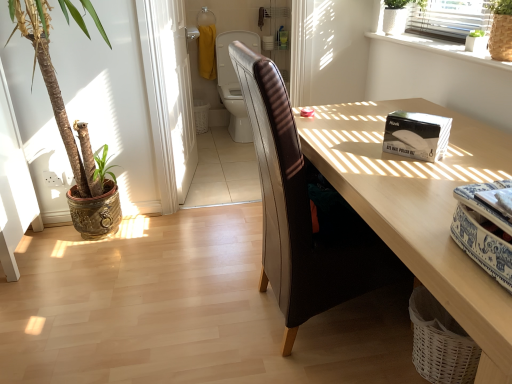
Where is `green leafy plant at upper right, which is counted as the third houseplant, starting from the left`? This screenshot has height=384, width=512. green leafy plant at upper right, which is counted as the third houseplant, starting from the left is located at coordinates (476, 41).

What do you see at coordinates (476, 41) in the screenshot? I see `green leafy plant at upper right, positioned as the second houseplant in right-to-left order` at bounding box center [476, 41].

Find the location of a particular element. This screenshot has height=384, width=512. woven beige basket at center is located at coordinates tap(201, 115).

Image resolution: width=512 pixels, height=384 pixels. I want to click on white textured plant at upper right, placed as the 3th houseplant when sorted from right to left, so click(398, 15).

What do you see at coordinates (421, 208) in the screenshot?
I see `light wood desk at center` at bounding box center [421, 208].

You are a GUI agent. You are given a task and a screenshot of the screen. Output one action in this format:
    pyautogui.click(x=<x>, y=<y>)
    Task: Click on the green woven basket at upper right, the first houseplant from the right
    This screenshot has height=384, width=512.
    Given the screenshot: What is the action you would take?
    pyautogui.click(x=501, y=30)

Find the location of a particular element. Image resolution: width=512 pixels, height=384 pixels. green leafy plant at upper right, which is counted as the third houseplant, starting from the left is located at coordinates (476, 41).

Which object is thinner, white glossy nail polish kit at upper right or woven beige basket at center?

white glossy nail polish kit at upper right is thinner.

Does white glossy nail polish kit at upper right have a smaller size compared to woven beige basket at center?

Indeed, white glossy nail polish kit at upper right has a smaller size compared to woven beige basket at center.

From a real-world perspective, is white glossy nail polish kit at upper right physically located above or below woven beige basket at center?

In terms of real-world spatial position, white glossy nail polish kit at upper right is above woven beige basket at center.

How many degrees apart are the facing directions of white glossy nail polish kit at upper right and woven beige basket at center?

56.8 degrees.

Find the location of a particular element. screen door above the leather at center (from a real-world perspective) is located at coordinates (169, 97).

From the image's perspective, is leather at center above or below white glossy screen door at upper center?

Clearly, from the image's perspective, leather at center is below white glossy screen door at upper center.

Is leather at center touching white glossy screen door at upper center?

leather at center is not next to white glossy screen door at upper center, and they're not touching.

Can you tell me how much leather at center and white glossy screen door at upper center differ in facing direction?

The angular difference between leather at center and white glossy screen door at upper center is 11 degrees.

Is green leafy plant at upper right, which is counted as the third houseplant, starting from the left, directly adjacent to white wicker laundry basket at lower right?

No, green leafy plant at upper right, which is counted as the third houseplant, starting from the left, is not next to white wicker laundry basket at lower right.

Is green leafy plant at upper right, positioned as the second houseplant in right-to-left order, facing towards white wicker laundry basket at lower right?

No, green leafy plant at upper right, positioned as the second houseplant in right-to-left order, is not aimed at white wicker laundry basket at lower right.

From the picture: Do you think green leafy plant at upper right, positioned as the second houseplant in right-to-left order, is within white wicker laundry basket at lower right, or outside of it?

green leafy plant at upper right, positioned as the second houseplant in right-to-left order, lies outside white wicker laundry basket at lower right.

Can you tell me how much green leafy plant at upper right, positioned as the second houseplant in right-to-left order, and white wicker laundry basket at lower right differ in facing direction?

They differ by 1.54 degrees in their facing directions.

From a real-world perspective, is leather-like brown swivel chair at center under white glossy nail polish kit at upper right?

Correct, in the physical world, leather-like brown swivel chair at center is lower than white glossy nail polish kit at upper right.

Is leather-like brown swivel chair at center in contact with white glossy nail polish kit at upper right?

leather-like brown swivel chair at center and white glossy nail polish kit at upper right are not in contact.

Between leather-like brown swivel chair at center and white glossy nail polish kit at upper right, which one appears on the right side from the viewer's perspective?

Positioned to the right is white glossy nail polish kit at upper right.

From their relative heights in the image, would you say leather-like brown swivel chair at center is taller or shorter than white glossy nail polish kit at upper right?

In the image, leather-like brown swivel chair at center appears to be taller than white glossy nail polish kit at upper right.

Which is more to the right, green leafy plant in textured pot at left, the first houseplant from the left, or leather-like brown swivel chair at center?

From the viewer's perspective, leather-like brown swivel chair at center appears more on the right side.

Considering the relative sizes of green leafy plant in textured pot at left, the first houseplant from the left, and leather-like brown swivel chair at center in the image provided, is green leafy plant in textured pot at left, the first houseplant from the left, bigger than leather-like brown swivel chair at center?

Yes.

From the image's perspective, which object appears higher, green leafy plant in textured pot at left, the first houseplant from the left, or leather-like brown swivel chair at center?

leather-like brown swivel chair at center is shown above in the image.

Is green leafy plant in textured pot at left, which is the 4th houseplant in right-to-left order, shorter than leather-like brown swivel chair at center?

In fact, green leafy plant in textured pot at left, which is the 4th houseplant in right-to-left order, may be taller than leather-like brown swivel chair at center.

How different are the orientations of white textured plant at upper right, marked as the 2th houseplant in a left-to-right arrangement, and white glossy window sill at upper right in degrees?

The angle between the facing direction of white textured plant at upper right, marked as the 2th houseplant in a left-to-right arrangement, and the facing direction of white glossy window sill at upper right is 0.488 degrees.

Which object is wider, white textured plant at upper right, placed as the 3th houseplant when sorted from right to left, or white glossy window sill at upper right?

white textured plant at upper right, placed as the 3th houseplant when sorted from right to left, is wider.

Would you say white textured plant at upper right, placed as the 3th houseplant when sorted from right to left, is outside white glossy window sill at upper right?

white textured plant at upper right, placed as the 3th houseplant when sorted from right to left, lies outside white glossy window sill at upper right's area.

Between woven beige basket at center and leather at center, which one has larger size?

leather at center.

Which object is thinner, woven beige basket at center or leather at center?

With smaller width is woven beige basket at center.

The height and width of the screenshot is (384, 512). In order to click on chair above the woven beige basket at center (from a real-world perspective) in this screenshot , I will do `click(301, 213)`.

Looking at this image, is woven beige basket at center surrounding leather at center?

No, leather at center is not inside woven beige basket at center.

The image size is (512, 384). Identify the location of basket directly beneath the white glossy nail polish kit at upper right (from a real-world perspective). (201, 115).

Identify the location of chair that is in front of the white glossy screen door at upper center. (301, 213).

When comparing their distances from light wood desk at center, does white glossy window sill at upper right or green leafy plant at upper right, positioned as the second houseplant in right-to-left order, seem further?

green leafy plant at upper right, positioned as the second houseplant in right-to-left order.

Estimate the real-world distances between objects in this image. Which object is further from white glossy nail polish kit at upper right, leather-like brown swivel chair at center or light wood desk at center?

Among the two, leather-like brown swivel chair at center is located further to white glossy nail polish kit at upper right.

From the picture: When comparing their distances from green leafy plant in textured pot at left, the first houseplant from the left, does white glossy nail polish kit at upper right or leather-like brown swivel chair at center seem closer?

The object closer to green leafy plant in textured pot at left, the first houseplant from the left, is white glossy nail polish kit at upper right.

From the picture: Estimate the real-world distances between objects in this image. Which object is further from woven beige basket at center, white glossy window sill at upper right or white glossy screen door at upper center?

white glossy window sill at upper right is further to woven beige basket at center.

Consider the image. Which object lies nearer to the anchor point leather at center, woven beige basket at center or white glossy screen door at upper center?

Among the two, white glossy screen door at upper center is located nearer to leather at center.

Looking at the image, which one is located further to green woven basket at upper right, which is the fourth houseplant in left-to-right order, white glossy window sill at upper right or leather-like brown swivel chair at center?

leather-like brown swivel chair at center is further to green woven basket at upper right, which is the fourth houseplant in left-to-right order.

Looking at this image, estimate the real-world distances between objects in this image. Which object is further from white wicker laundry basket at lower right, woven beige basket at center or white textured plant at upper right, marked as the 2th houseplant in a left-to-right arrangement?

woven beige basket at center lies further to white wicker laundry basket at lower right than the other object.

Which object lies nearer to the anchor point green leafy plant in textured pot at left, which is the 4th houseplant in right-to-left order, leather at center or light wood desk at center?

leather at center is positioned closer to the anchor green leafy plant in textured pot at left, which is the 4th houseplant in right-to-left order.

The image size is (512, 384). What are the coordinates of `box that lies between green woven basket at upper right, the first houseplant from the right, and white wicker laundry basket at lower right from top to bottom` in the screenshot? It's located at (416, 135).

Where is `window between green woven basket at upper right, which is the fourth houseplant in left-to-right order, and leather-like brown swivel chair at center from front to back`? The width and height of the screenshot is (512, 384). window between green woven basket at upper right, which is the fourth houseplant in left-to-right order, and leather-like brown swivel chair at center from front to back is located at coordinates (439, 45).

Identify the location of window positioned between light wood desk at center and white textured plant at upper right, marked as the 2th houseplant in a left-to-right arrangement, from near to far. The width and height of the screenshot is (512, 384). coord(439,45).

Identify the location of swivel chair located between light wood desk at center and woven beige basket at center in the depth direction. The height and width of the screenshot is (384, 512). (234, 83).